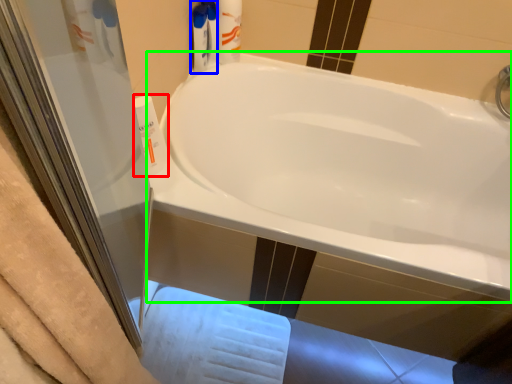
Question: Which is farther away from cleaning product (highlighted by a red box)? cleaning product (highlighted by a blue box) or bathtub (highlighted by a green box)?

Choices:
 (A) cleaning product
 (B) bathtub

Answer: (B)